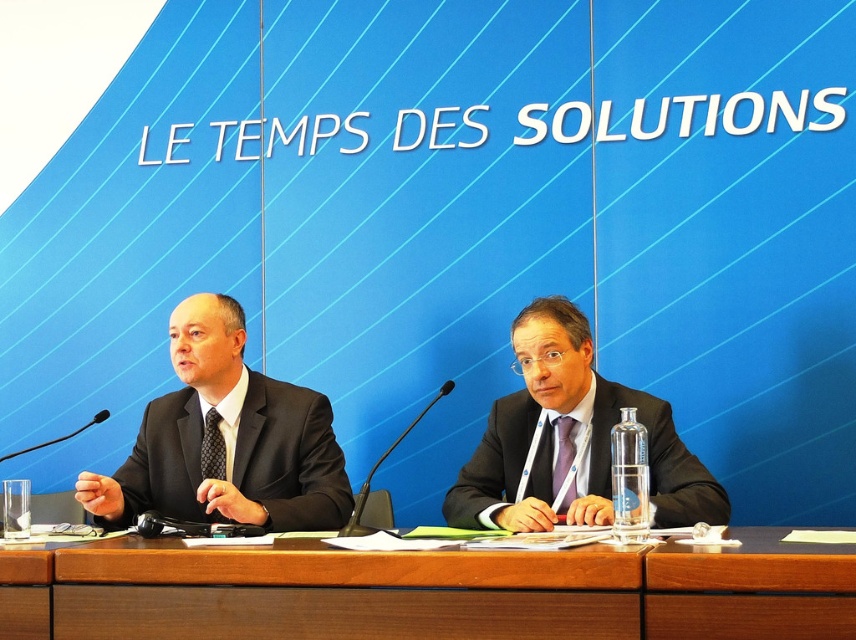
Question: Which point is closer to the camera?

Choices:
 (A) (462, 632)
 (B) (333, 484)

Answer: (A)

Question: From the image, what is the correct spatial relationship of brown wood table at center in relation to matte black suit at center?

Choices:
 (A) right
 (B) left

Answer: (B)

Question: Observing the image, what is the correct spatial positioning of black matte suit at left in reference to matte black suit at center?

Choices:
 (A) below
 (B) above

Answer: (B)

Question: Can you confirm if brown wood table at center is wider than black matte suit at left?

Choices:
 (A) no
 (B) yes

Answer: (B)

Question: Among these objects, which one is farthest from the camera?

Choices:
 (A) black matte suit at left
 (B) matte black suit at center

Answer: (A)

Question: Which object is positioned farthest from the matte black suit at center?

Choices:
 (A) black matte suit at left
 (B) brown wood table at center

Answer: (A)